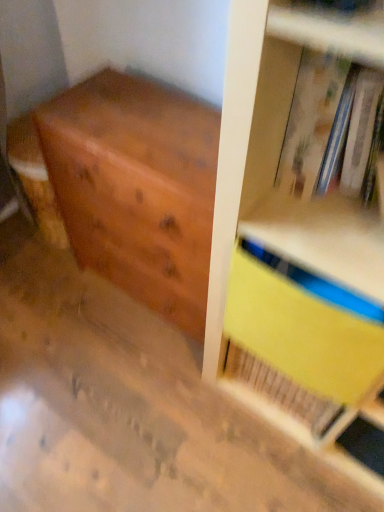
At what (x,y) coordinates should I click in order to perform the action: click on free point above wooden chest of drawers at left (from a real-world perspective). Please return your answer as a coordinate pair (x, y). Looking at the image, I should click on coord(144,138).